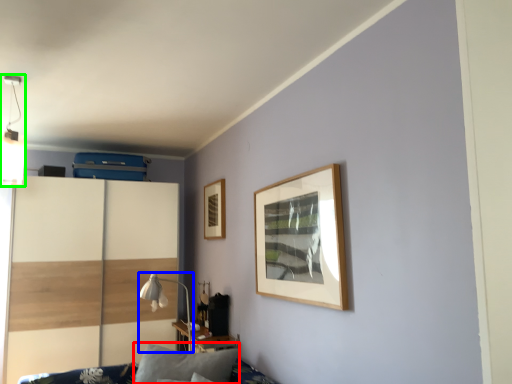
Question: Based on their relative distances, which object is nearer to pillow (highlighted by a red box)? Choose from table lamp (highlighted by a blue box) and light fixture (highlighted by a green box).

Choices:
 (A) table lamp
 (B) light fixture

Answer: (A)